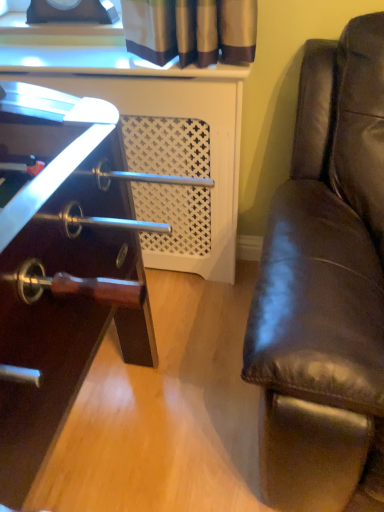
Locate an element on the screen. This screenshot has width=384, height=512. free space underneath dark wood foosball table at left (from a real-world perspective) is located at coordinates (127, 422).